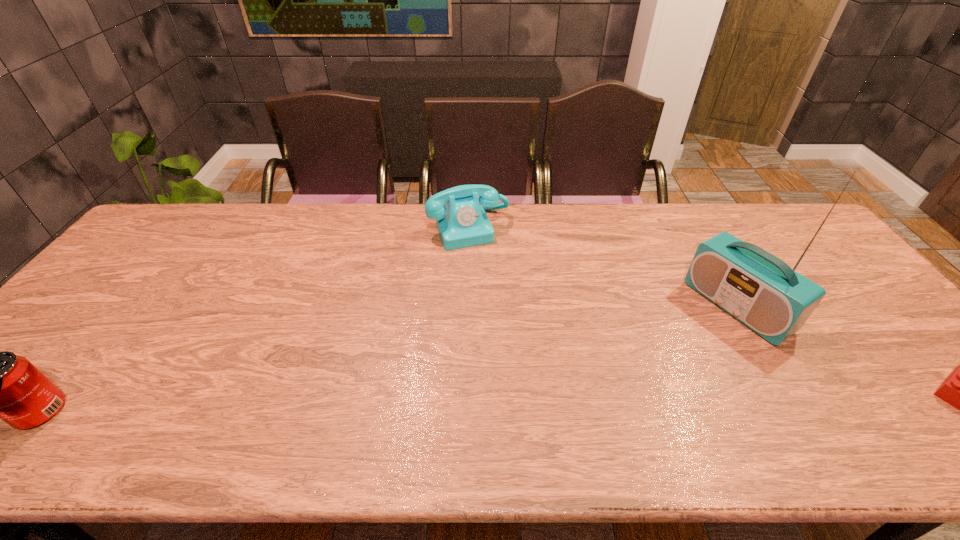
Locate an element on the screen. The image size is (960, 540). the leftmost object is located at coordinates click(0, 385).

The height and width of the screenshot is (540, 960). I want to click on telephone, so click(462, 222).

Locate an element on the screen. This screenshot has height=540, width=960. the farthest object is located at coordinates (462, 222).

This screenshot has height=540, width=960. What are the coordinates of `the tallest object` in the screenshot? It's located at (760, 290).

The width and height of the screenshot is (960, 540). Find the location of `the second object from right to left`. the second object from right to left is located at coordinates (760, 290).

Find the location of a particular element. Image resolution: width=960 pixels, height=540 pixels. free space located 0.320m on the back of the soda can is located at coordinates (136, 292).

Where is `blank area located on the dial of the second object from left to right`? blank area located on the dial of the second object from left to right is located at coordinates (504, 306).

You are a GUI agent. You are given a task and a screenshot of the screen. Output one action in this format:
    pyautogui.click(x=<x>, y=<y>)
    Task: Click on the vacant space situated on the dial of the second object from left to right
    The image size is (960, 540).
    Given the screenshot: What is the action you would take?
    [x=495, y=286]

Where is `free space located on the dial of the second object from left to right`? The width and height of the screenshot is (960, 540). free space located on the dial of the second object from left to right is located at coordinates (504, 306).

Find the location of `vacant region located 0.150m on the front panel of the tallest object`. vacant region located 0.150m on the front panel of the tallest object is located at coordinates (673, 354).